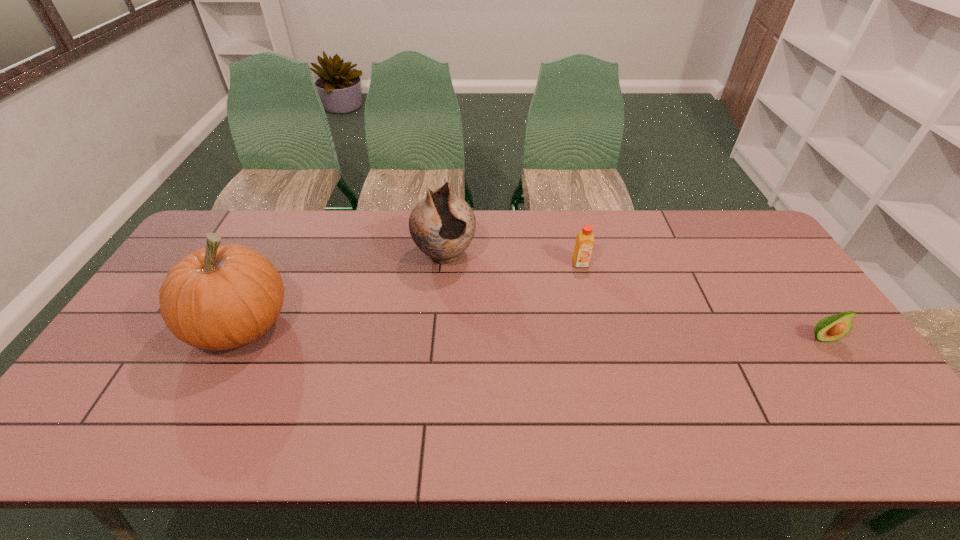
The width and height of the screenshot is (960, 540). Find the location of `vacant space at the right edge`. vacant space at the right edge is located at coordinates (785, 310).

The image size is (960, 540). In the image, there is a desktop. What are the coordinates of `vacant space at the far left corner` in the screenshot? It's located at (228, 213).

The image size is (960, 540). I want to click on vacant area at the far right corner of the desktop, so click(748, 227).

Identify the location of free space between the rightmost object and the pottery. (634, 296).

What are the coordinates of `unoccupied area between the third tallest object and the rightmost object` in the screenshot? It's located at (701, 301).

Image resolution: width=960 pixels, height=540 pixels. I want to click on free point between the shortest object and the second object from right to left, so click(x=701, y=301).

The height and width of the screenshot is (540, 960). I want to click on free space between the third tallest object and the avocado, so click(701, 301).

At what (x,y) coordinates should I click in order to perform the action: click on free space between the avocado and the pottery. Please return your answer as a coordinate pair (x, y). This screenshot has width=960, height=540. Looking at the image, I should click on (634, 296).

Where is `vacant space in between the leftmost object and the shortest object`? This screenshot has height=540, width=960. vacant space in between the leftmost object and the shortest object is located at coordinates pos(532,332).

Locate an element on the screen. Image resolution: width=960 pixels, height=540 pixels. free space between the avocado and the third tallest object is located at coordinates (701, 301).